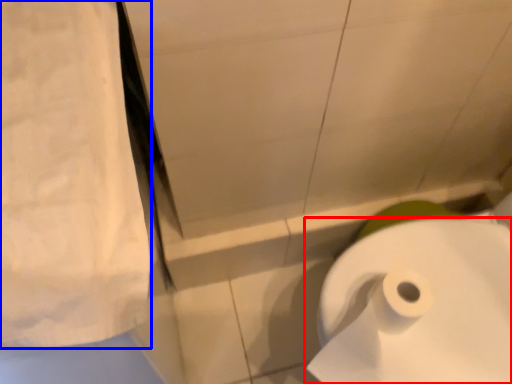
Question: Which of the following is the closest to the observer, toilet paper (highlighted by a red box) or linen (highlighted by a blue box)?

Choices:
 (A) toilet paper
 (B) linen

Answer: (B)